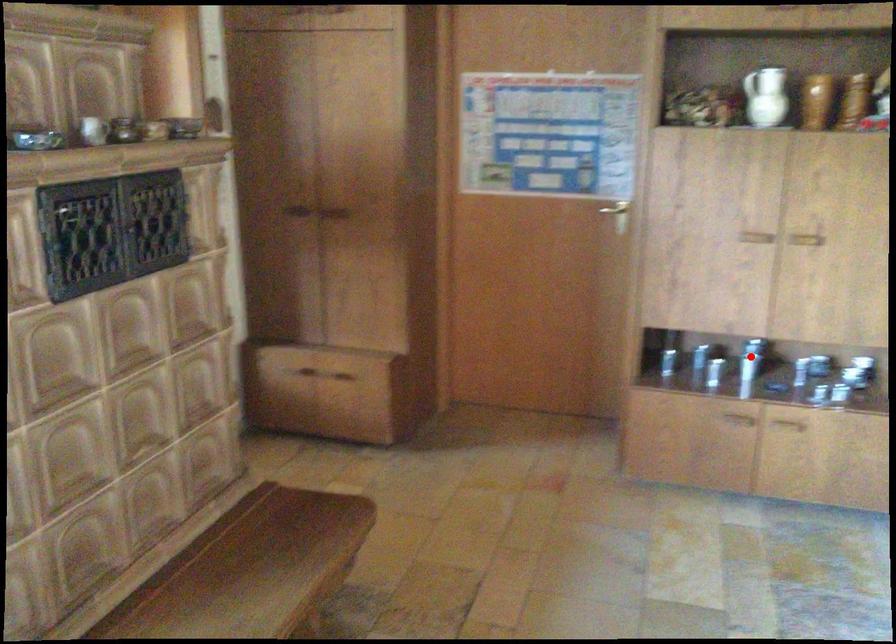
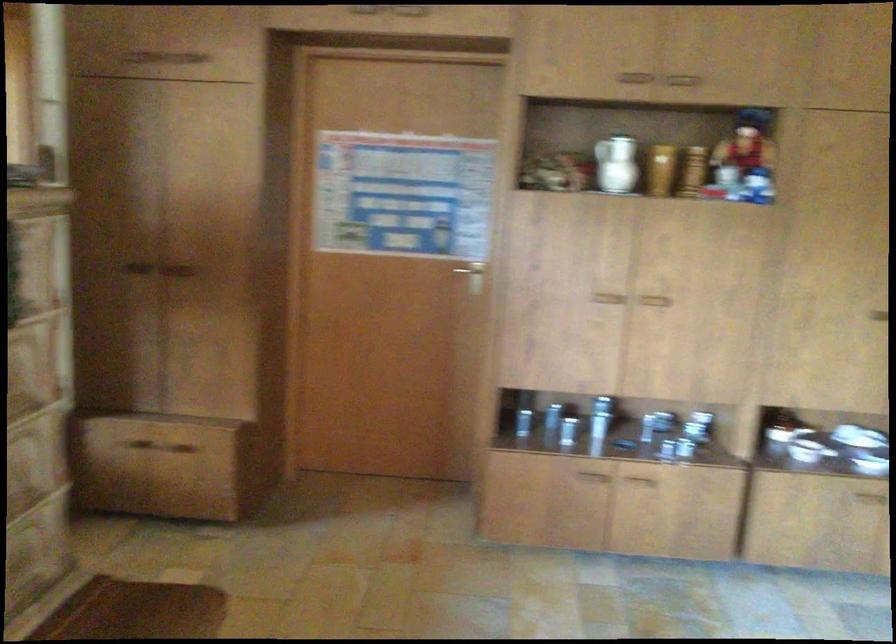
The point at the highlighted location is marked in the first image. Where is the corresponding point in the second image?

(606, 415)